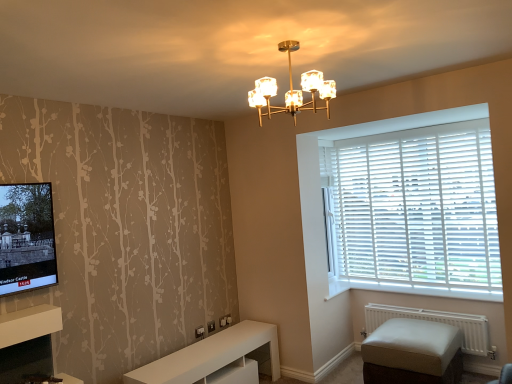
In order to click on blank space situated above white matte radiator at lower right (from a real-world perspective) in this screenshot , I will do pyautogui.click(x=418, y=306).